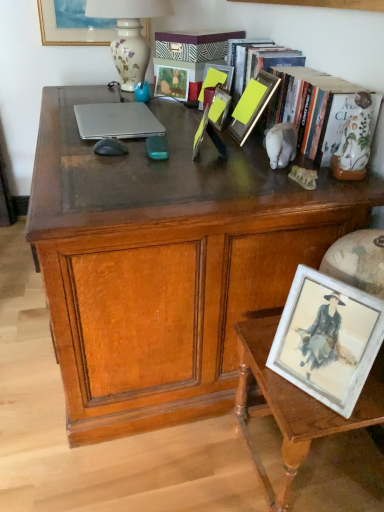
This screenshot has width=384, height=512. I want to click on vacant area that is in front of transparent plastic mobile phone at center, so click(146, 170).